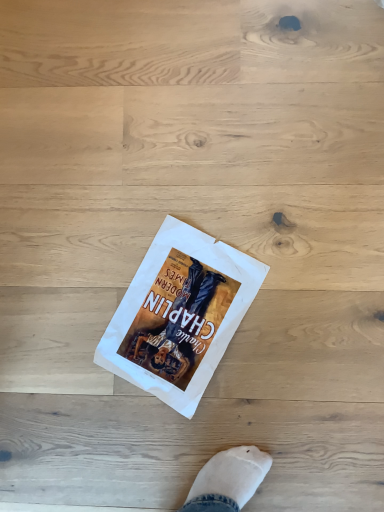
This screenshot has width=384, height=512. What are the coordinates of `free spot above white paper bag at center (from a real-world perspective)` in the screenshot? It's located at (171, 310).